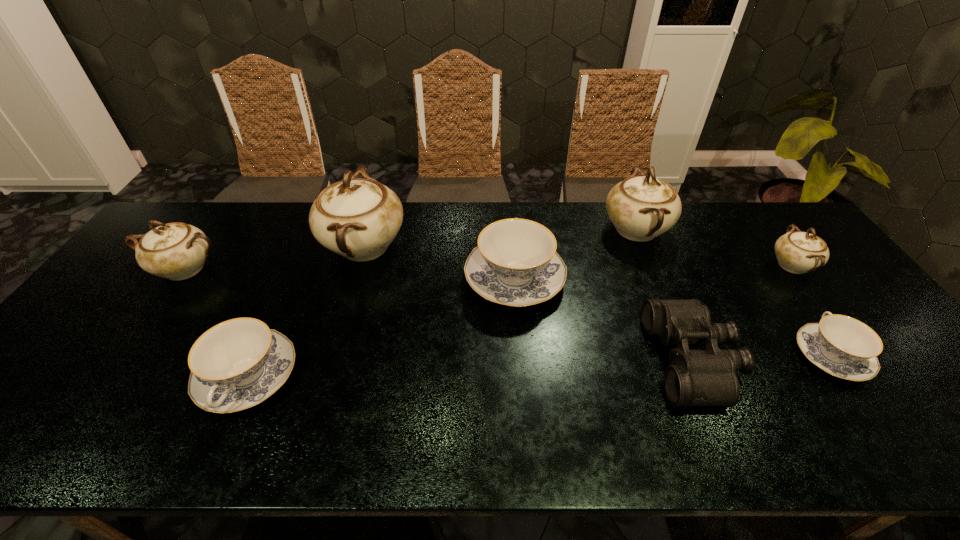
Find the location of a particular element. the tallest object is located at coordinates (358, 218).

This screenshot has height=540, width=960. I want to click on the third white chinaware from right to left, so (358, 218).

Find the location of a particular element. The height and width of the screenshot is (540, 960). the fifth chinaware from left to right is located at coordinates (641, 208).

Where is `the seventh shortest object`? the seventh shortest object is located at coordinates (641, 208).

Locate an element on the screen. Image resolution: width=960 pixels, height=540 pixels. the third tallest chinaware is located at coordinates (177, 251).

This screenshot has height=540, width=960. I want to click on the third biggest white chinaware, so click(x=177, y=251).

Find the location of a particular element. Image resolution: width=960 pixels, height=540 pixels. the second blue chinaware from left to right is located at coordinates (516, 264).

Where is `the biggest blue chinaware`? The width and height of the screenshot is (960, 540). the biggest blue chinaware is located at coordinates (516, 264).

This screenshot has height=540, width=960. Find the location of `the smallest white chinaware`. the smallest white chinaware is located at coordinates (798, 252).

Locate an element on the screen. This screenshot has width=960, height=540. black binoculars is located at coordinates (707, 377).